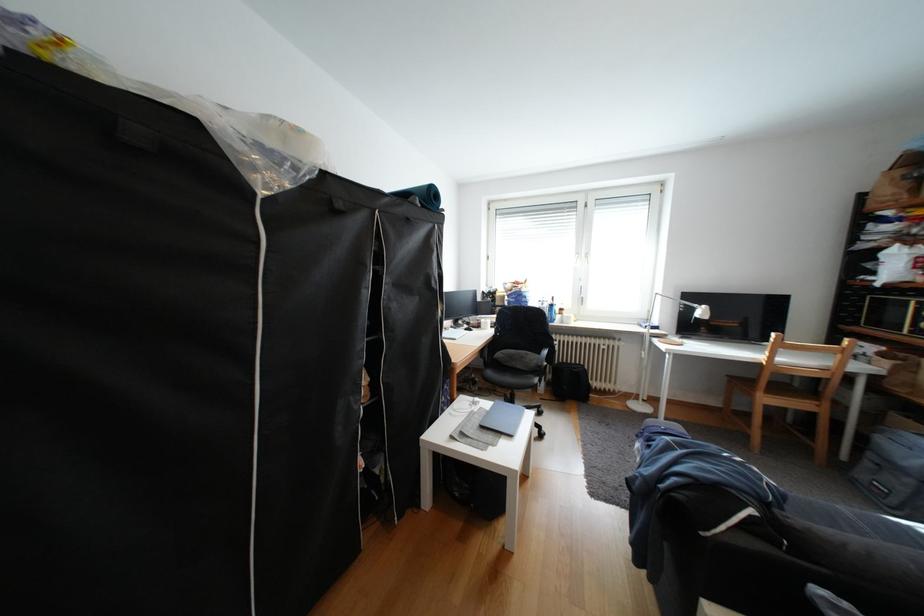
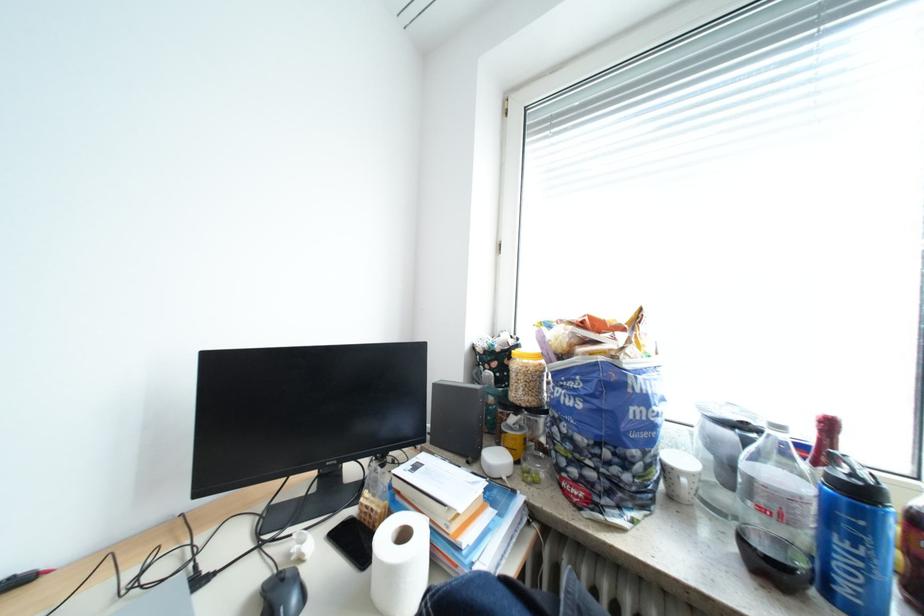
The point at (564, 306) is marked in the first image. Where is the corresponding point in the second image?

(873, 493)